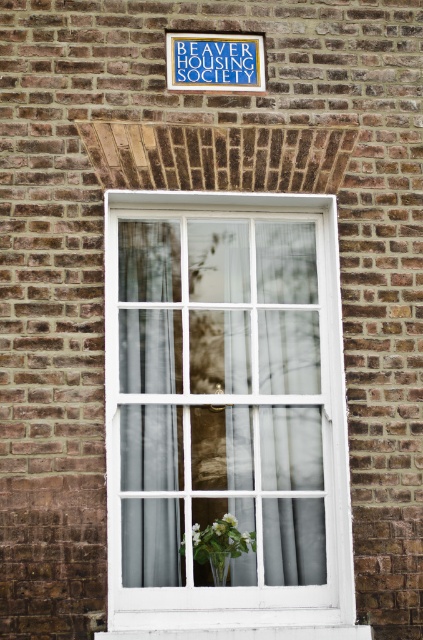
Does green matte flower at center come in front of white matte flower at lower center?

Yes, it is in front of white matte flower at lower center.

Between green matte flower at center and white matte flower at lower center, which one appears on the right side from the viewer's perspective?

Positioned to the right is white matte flower at lower center.

Where is `green matte flower at center`? This screenshot has width=423, height=640. green matte flower at center is located at coordinates (219, 525).

Which of these two, green leafy plant at center or translucent glass vase at lower center, stands taller?

green leafy plant at center is taller.

Can you confirm if green leafy plant at center is thinner than translucent glass vase at lower center?

No, green leafy plant at center is not thinner than translucent glass vase at lower center.

Where is `green leafy plant at center`? green leafy plant at center is located at coordinates (220, 544).

Locate an element on the screen. green leafy plant at center is located at coordinates (220, 544).

Is point (167, 70) positioned in front of point (220, 582)?

That is False.

Is blue plastic sign at upper center further to camera compared to translucent glass vase at lower center?

That is True.

Who is more forward, (170,42) or (224,573)?

Point (224,573) is in front.

Find the location of a particular element. blue plastic sign at upper center is located at coordinates (214, 61).